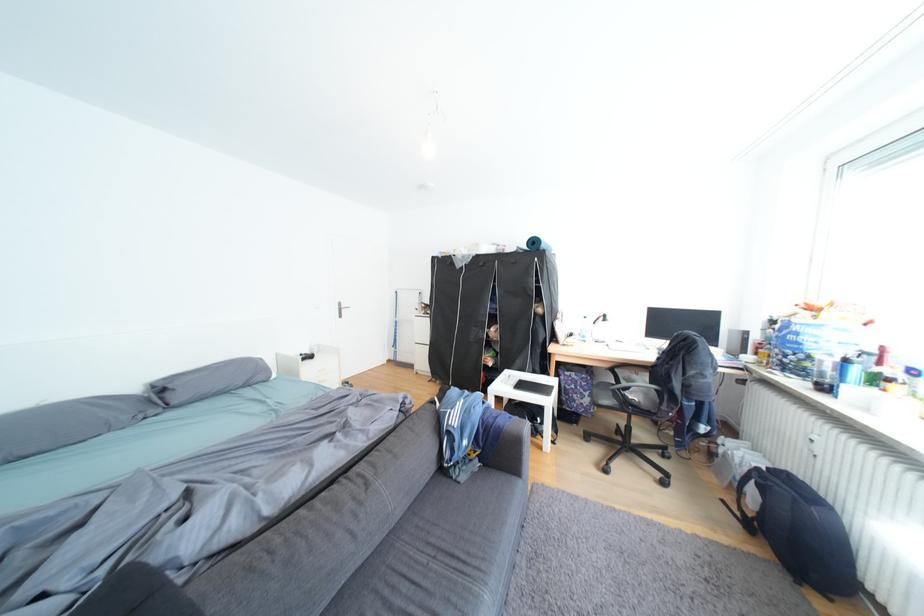
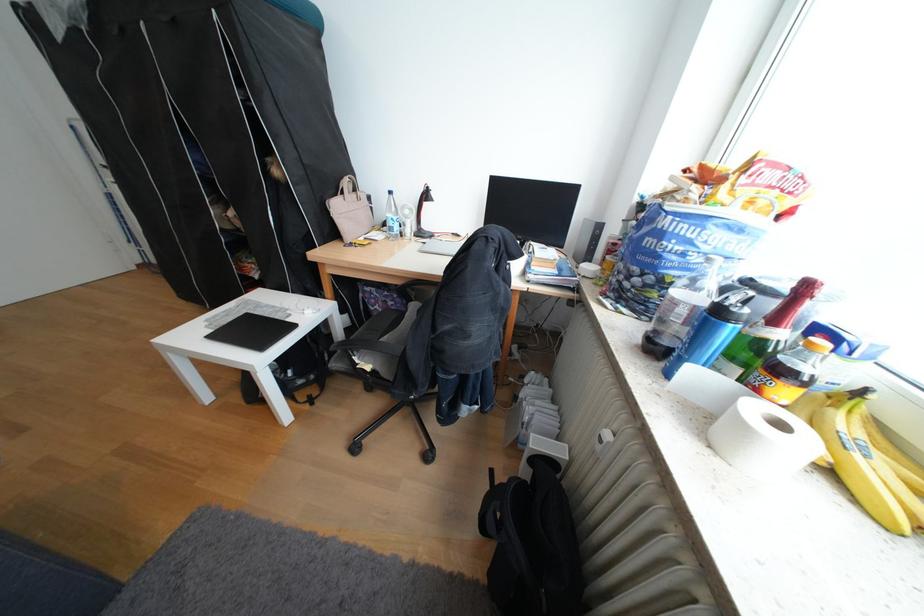
Find the pixel in the second image that matches point (896, 350) in the first image.

(819, 288)